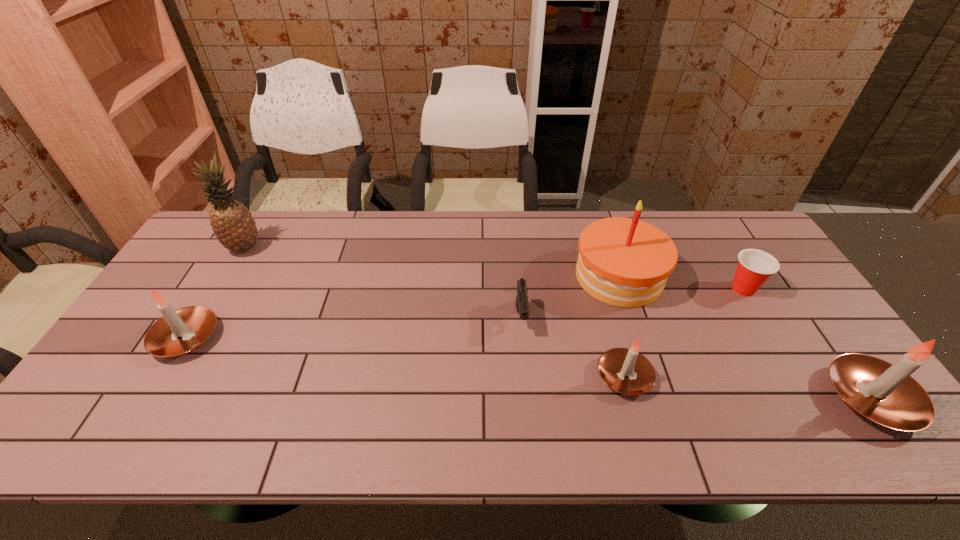
At what (x,y) coordinates should I click in order to perform the action: click on blank space located on the back of the second shortest candle. Please return your answer as a coordinate pair (x, y). The width and height of the screenshot is (960, 540). Looking at the image, I should click on (225, 274).

Locate an element on the screen. The width and height of the screenshot is (960, 540). vacant position located 0.060m on the left of the shortest candle is located at coordinates (572, 376).

Locate an element on the screen. The width and height of the screenshot is (960, 540). vacant area situated on the left of the fifth shortest object is located at coordinates (764, 399).

Find the location of a particular element. The image size is (960, 540). vacant space positioned on the back of the pineapple is located at coordinates (256, 227).

Where is `blank space located on the front of the birthday cake`? This screenshot has width=960, height=540. blank space located on the front of the birthday cake is located at coordinates (643, 350).

Locate an element on the screen. free space located at the barrel of the pistol is located at coordinates (529, 404).

Locate an element on the screen. The height and width of the screenshot is (540, 960). vacant space located on the back of the cup is located at coordinates (709, 232).

Find the location of `pineapple that is positioned at the far edge`. pineapple that is positioned at the far edge is located at coordinates (232, 222).

At what (x,y) coordinates should I click in order to perform the action: click on birthday cake that is positioned at the far edge. Please return your answer as a coordinate pair (x, y). This screenshot has width=960, height=540. Looking at the image, I should click on (625, 262).

Where is `candle at the left edge`? The image size is (960, 540). candle at the left edge is located at coordinates 181,331.